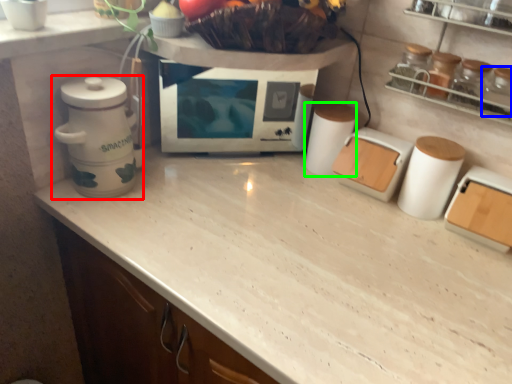
Question: Considering the real-world distances, which object is farthest from home appliance (highlighted by a red box)? bottle (highlighted by a blue box) or appliance (highlighted by a green box)?

Choices:
 (A) bottle
 (B) appliance

Answer: (A)